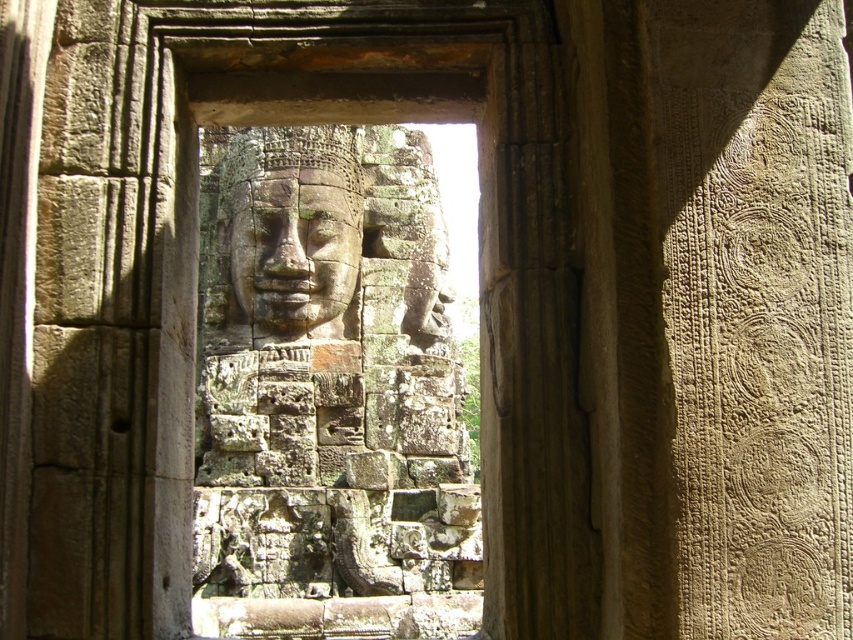
Question: Which point is closer to the camera?

Choices:
 (A) (222, 195)
 (B) (338, 225)

Answer: (B)

Question: Which point is closer to the camera?

Choices:
 (A) (248, 570)
 (B) (299, 252)

Answer: (A)

Question: Is weathered stone face at center thinner than carved stone face at center?

Choices:
 (A) no
 (B) yes

Answer: (A)

Question: Which object appears farthest from the camera in this image?

Choices:
 (A) weathered stone face at center
 (B) carved stone face at center

Answer: (B)

Question: Can you confirm if weathered stone face at center is smaller than carved stone face at center?

Choices:
 (A) yes
 (B) no

Answer: (B)

Question: Is weathered stone face at center wider than carved stone face at center?

Choices:
 (A) yes
 (B) no

Answer: (A)